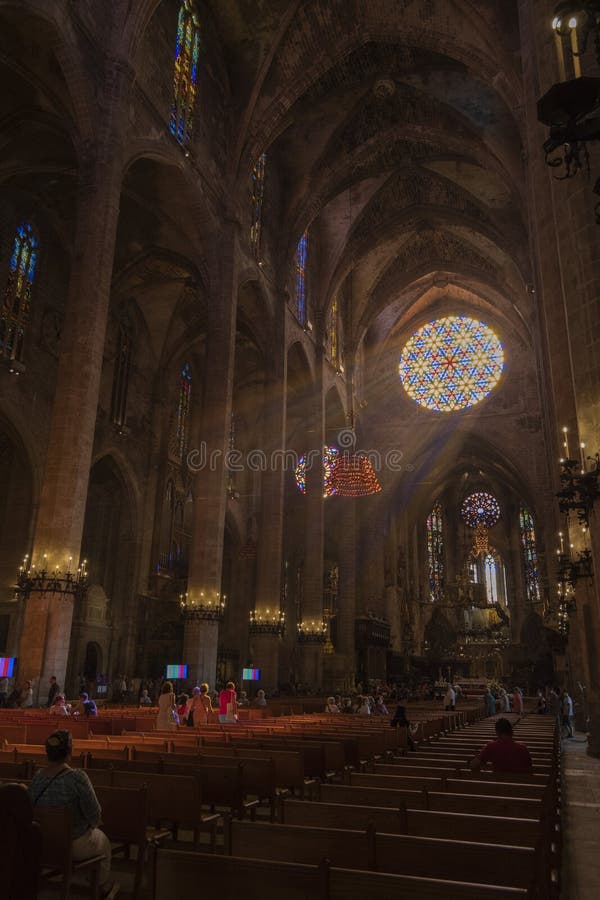
The width and height of the screenshot is (600, 900). Find the location of `floor`. floor is located at coordinates pyautogui.click(x=584, y=821).